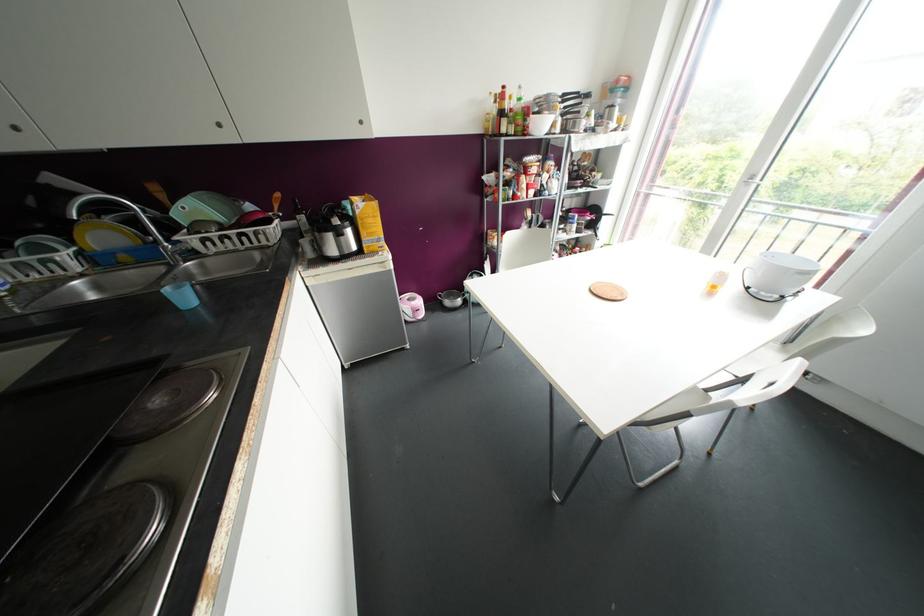
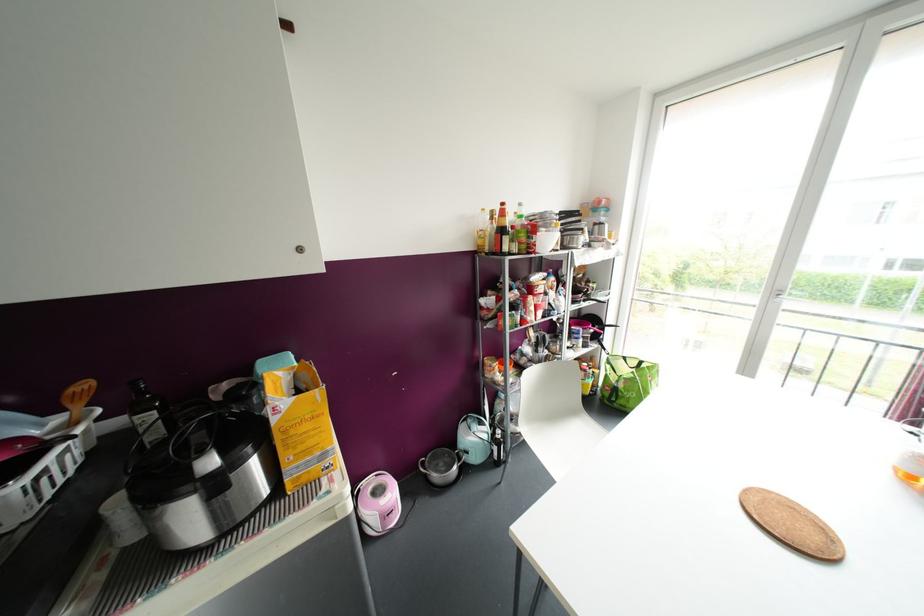
The point at [301,217] is marked in the first image. Where is the corresponding point in the second image?

(150, 416)